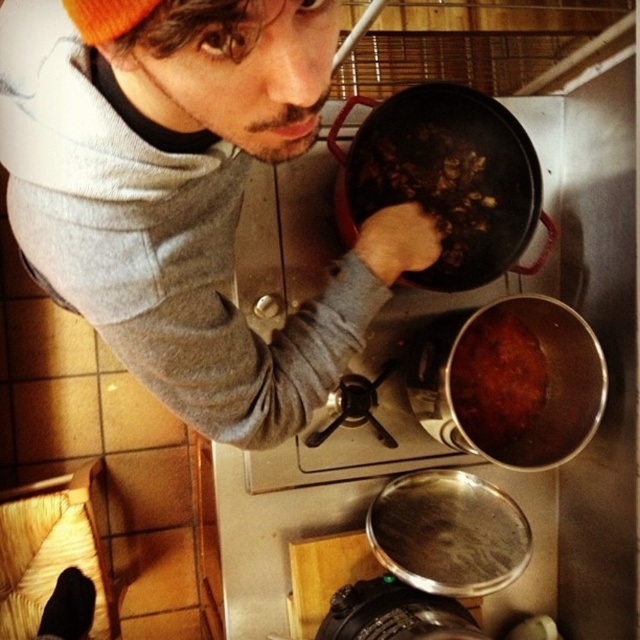
Is matte gray sweater at upper left bigger than brown matte food at center?

Indeed, matte gray sweater at upper left has a larger size compared to brown matte food at center.

Does point (230, 317) come farther from viewer compared to point (449, 250)?

No, it is not.

Where is `matte gray sweater at upper left`? matte gray sweater at upper left is located at coordinates (182, 195).

Does matte gray sweater at upper left lie behind brown matte pot at lower right?

No.

Is point (330, 291) more distant than point (506, 336)?

That is False.

At what (x,y) coordinates should I click in order to perform the action: click on matte gray sweater at upper left. Please return your answer as a coordinate pair (x, y). The width and height of the screenshot is (640, 640). Looking at the image, I should click on (182, 195).

Is matte black frying pan at center closer to camera compared to brown matte food at center?

Yes.

The image size is (640, 640). Describe the element at coordinates (445, 179) in the screenshot. I see `matte black frying pan at center` at that location.

Where is `matte black frying pan at center`? matte black frying pan at center is located at coordinates (445, 179).